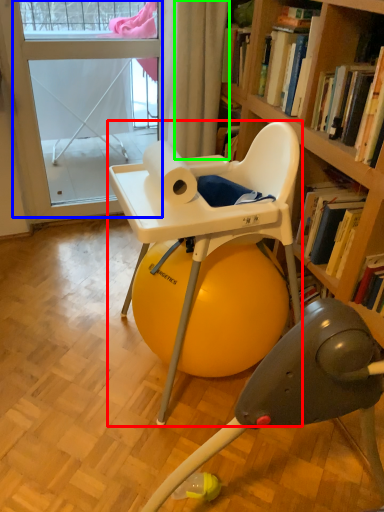
Question: Considering the real-world distances, which object is farthest from chair (highlighted by a red box)? screen door (highlighted by a blue box) or curtain (highlighted by a green box)?

Choices:
 (A) screen door
 (B) curtain

Answer: (A)